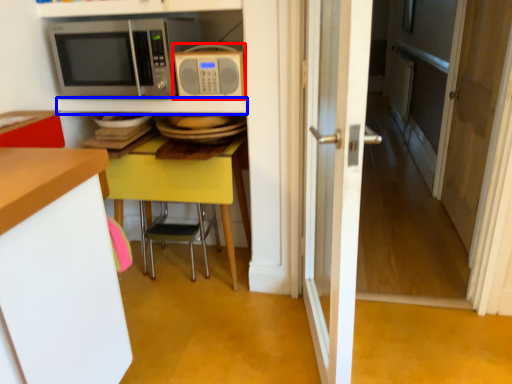
Question: Which object is closer to the camera taking this photo, microwave oven (highlighted by a red box) or shelf (highlighted by a blue box)?

Choices:
 (A) microwave oven
 (B) shelf

Answer: (A)